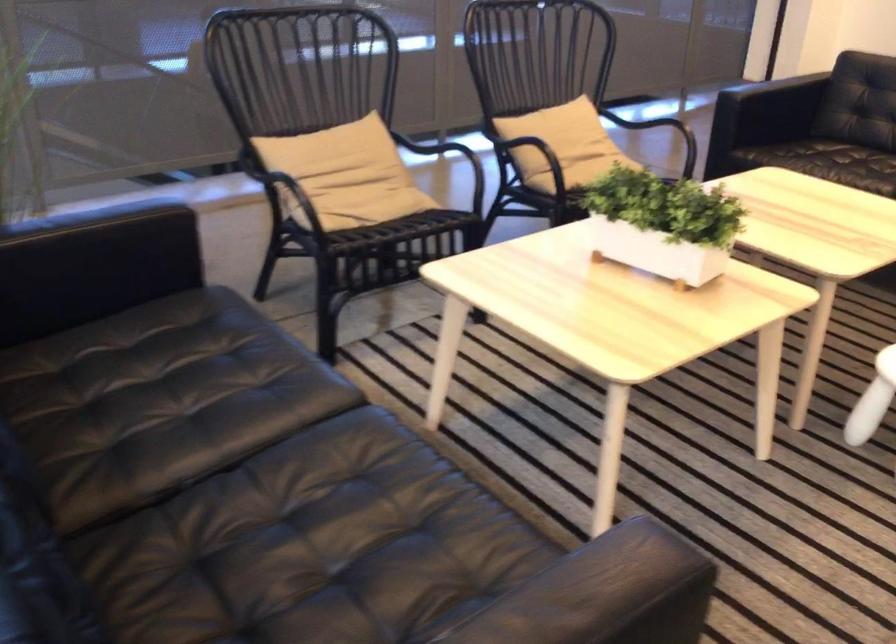
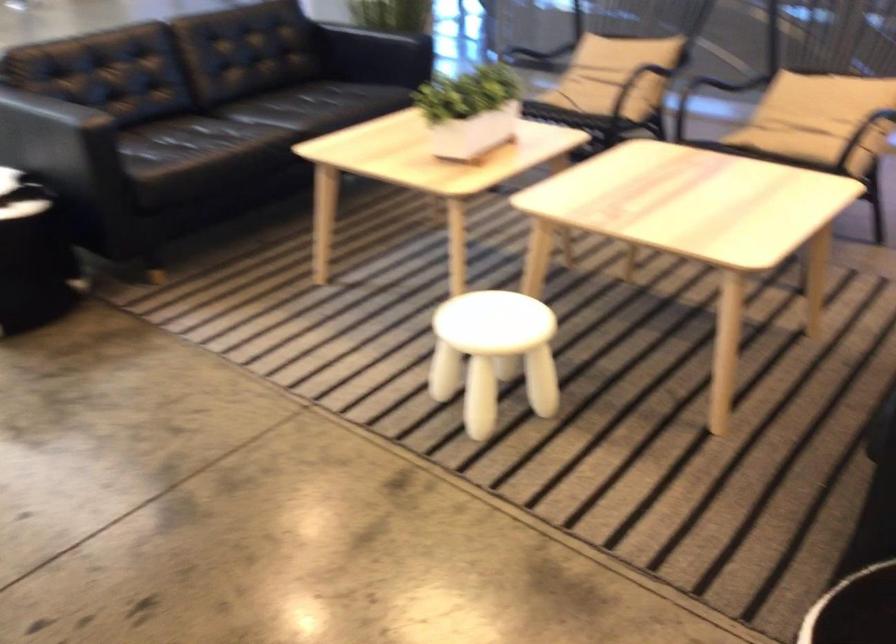
Find the pixel in the second image that matches point (375, 201) in the first image.

(597, 91)